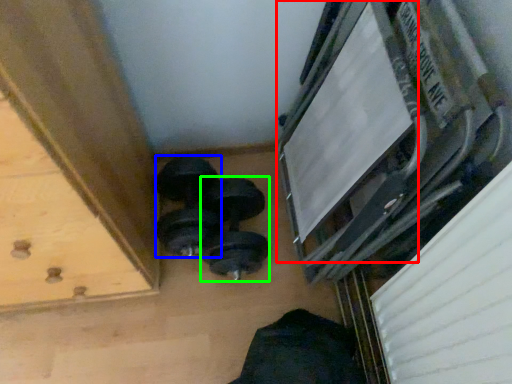
Question: Which object is the closest to the window frame (highlighted by a red box)? Choose among these: dumbbell (highlighted by a blue box) or dumbbell (highlighted by a green box).

Choices:
 (A) dumbbell
 (B) dumbbell

Answer: (B)